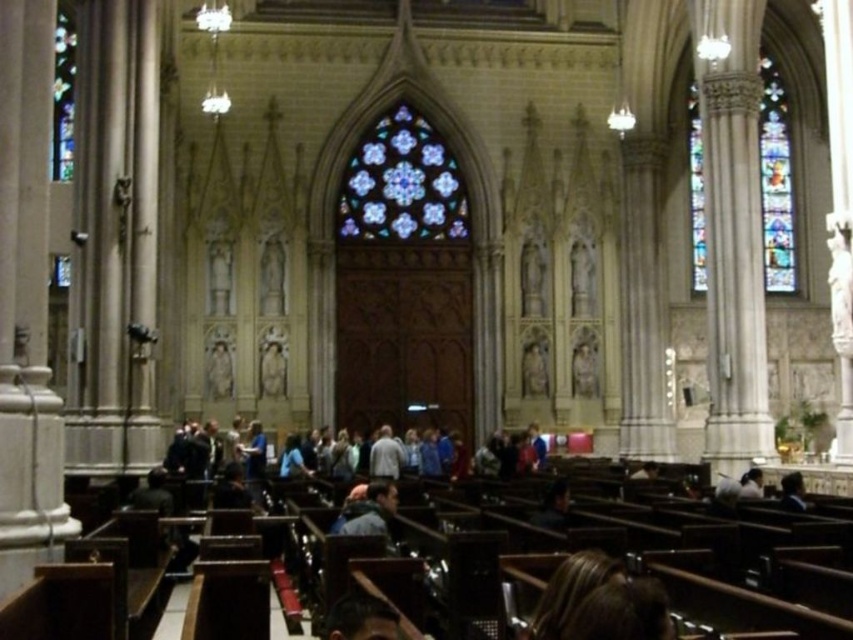
Question: Based on their relative distances, which object is nearer to the light gray fabric jacket at center?

Choices:
 (A) light brown leather jacket at lower right
 (B) dark brown leather jacket at lower center
 (C) smooth black jacket at lower right
 (D) stained glass window at right

Answer: (A)

Question: Which point is farther to the camera?

Choices:
 (A) (381, 429)
 (B) (761, 212)
 (C) (397, 230)

Answer: (B)

Question: Is stained glass window at upper left to the left of smooth black jacket at lower right from the viewer's perspective?

Choices:
 (A) no
 (B) yes

Answer: (B)

Question: Can you confirm if stained glass window at right is positioned to the left of stained glass window at upper left?

Choices:
 (A) no
 (B) yes

Answer: (A)

Question: Does gray fabric jacket at center appear on the right side of light brown leather jacket at lower right?

Choices:
 (A) yes
 (B) no

Answer: (B)

Question: Which object is the farthest from the stained glass window at right?

Choices:
 (A) stained glass at center
 (B) light brown leather jacket at lower right

Answer: (B)